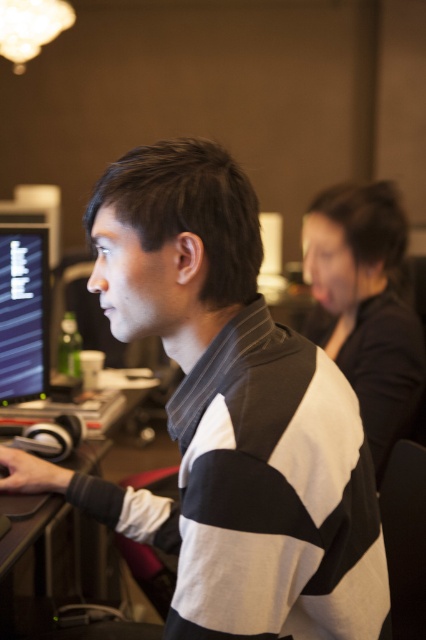
You are a delivery person who needs to place a package between the matte black monitor at left and the black plastic computer desk at lower left. The package is 35 inches long. Can you fit it between them without moving either object?

The distance between the matte black monitor at left and the black plastic computer desk at lower left is 34.24 inches. Since the package is 35 inches long, it cannot fit between them without moving either object.

You are a new employee in this office and need to locate the headphones. You see the black matte shirt at upper right and the matte black monitor at left. Which object is closer to you?

The black matte shirt at upper right is closer to you because it is further to the viewer than the matte black monitor at left.

You are an office assistant who needs to deliver a message to the person wearing the black matte shirt at upper right. The monitor at left is blocking your path. Can you walk around the matte black monitor at left to reach them?

The black matte shirt at upper right is positioned on the right side of the matte black monitor at left, so you can walk around the monitor to reach the person wearing the black matte shirt at upper right.